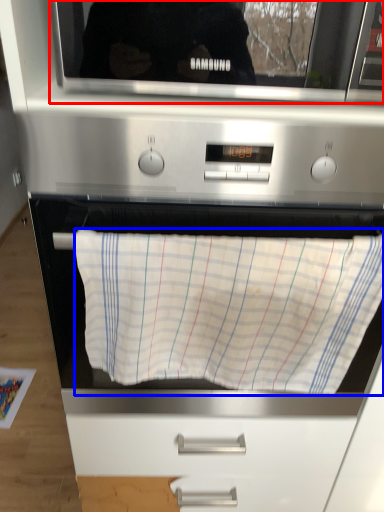
Question: Among these objects, which one is nearest to the camera, microwave oven (highlighted by a red box) or blanket (highlighted by a blue box)?

Choices:
 (A) microwave oven
 (B) blanket

Answer: (A)